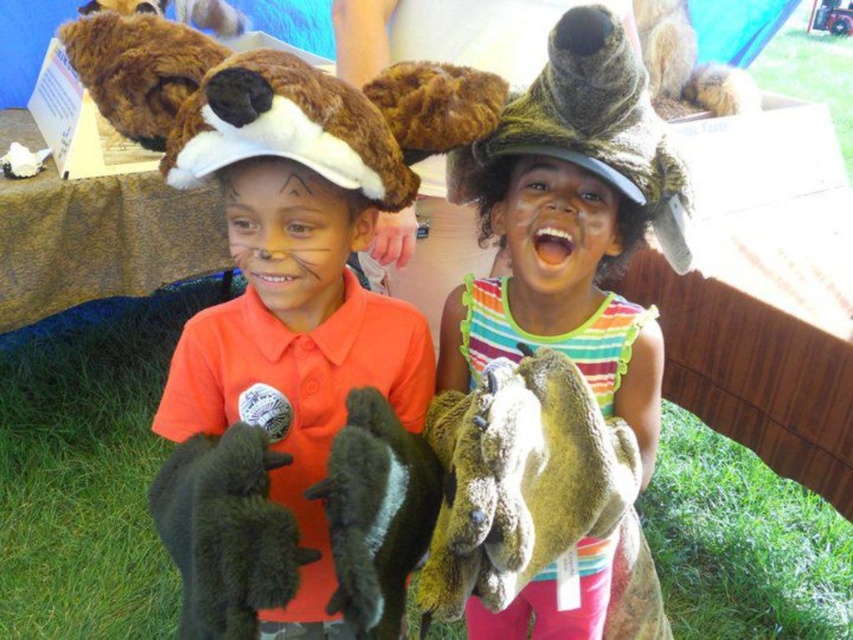
Question: Does fuzzy brown hat at upper left appear on the left side of dark green plush fish at center?

Choices:
 (A) no
 (B) yes

Answer: (B)

Question: Which point is farther from the camera taking this photo?

Choices:
 (A) (590, 515)
 (B) (277, 604)
 (C) (421, 531)

Answer: (A)

Question: Which object appears closest to the camera in this image?

Choices:
 (A) dark green plush rabbit at lower left
 (B) dark green plush fish at center
 (C) green fuzzy puppet at center
 (D) fuzzy brown hat at upper left

Answer: (A)

Question: Can you confirm if green fuzzy puppet at center is thinner than dark green plush fish at center?

Choices:
 (A) yes
 (B) no

Answer: (B)

Question: Can you confirm if fuzzy brown hat at upper left is positioned to the left of green fuzzy puppet at center?

Choices:
 (A) no
 (B) yes

Answer: (B)

Question: Which point is farther from the camera taking this photo?

Choices:
 (A) (635, 116)
 (B) (379, 522)
 (C) (589, 392)
 (D) (281, 541)

Answer: (A)